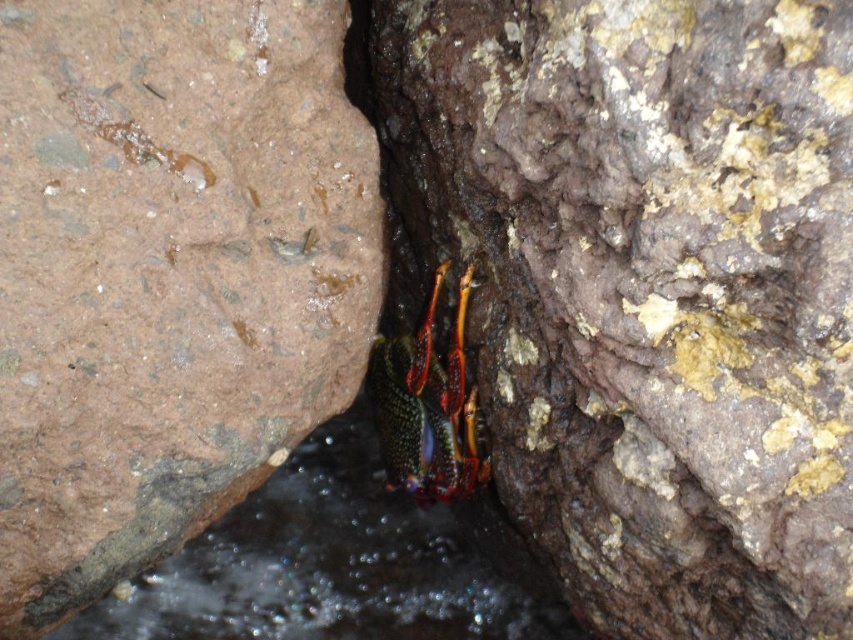
Question: Is brown rough rock at left below shiny metallic hermit crab at center?

Choices:
 (A) yes
 (B) no

Answer: (B)

Question: Observing the image, what is the correct spatial positioning of rusty rock at center in reference to shiny metallic hermit crab at center?

Choices:
 (A) left
 (B) right

Answer: (B)

Question: Which object is closer to the camera taking this photo?

Choices:
 (A) rusty rock at center
 (B) clear water at center
 (C) brown rough rock at left
 (D) shiny metallic hermit crab at center

Answer: (A)

Question: Which point is farther to the camera?

Choices:
 (A) (457, 490)
 (B) (376, 257)
 (C) (292, 592)

Answer: (C)

Question: Is brown rough rock at left below clear water at center?

Choices:
 (A) no
 (B) yes

Answer: (A)

Question: Which is nearer to the clear water at center?

Choices:
 (A) shiny metallic hermit crab at center
 (B) brown rough rock at left

Answer: (A)